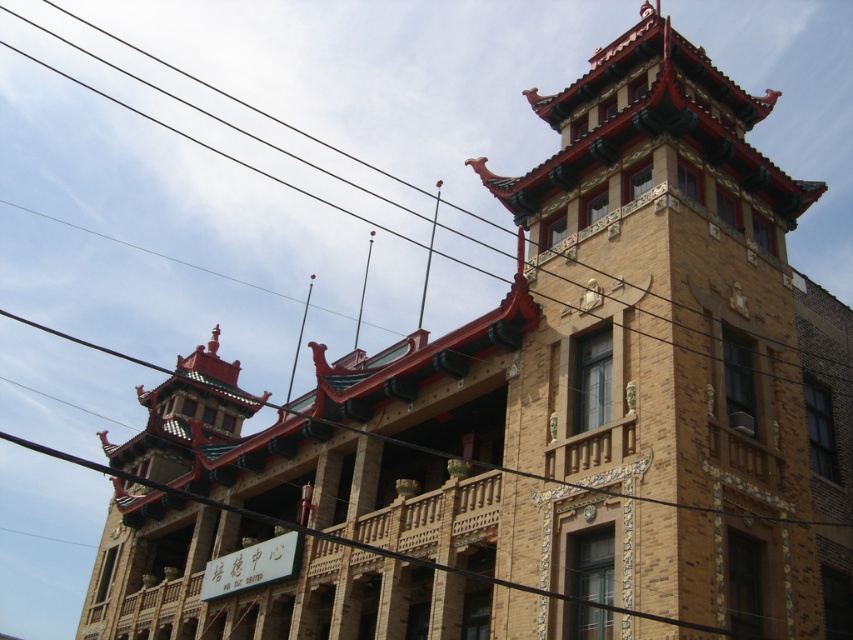
You are an architect analyzing the building. You observe the yellow brick tower at upper center and the black wire at upper center. Which of these two objects has a smaller width?

The yellow brick tower at upper center has a smaller width than the black wire at upper center.

You are standing at the entrance of the building and want to walk towards the point at coordinates point (x=698, y=305) and point (x=283, y=180). Which point will you reach first?

You will reach point (x=698, y=305) first because it is in front of point (x=283, y=180) from your current position.

You are an architect analyzing the building depicted in the image. You notice the yellow brick tower at upper center and the black wire at upper center. Which of these two elements is positioned higher in the structure?

The black wire at upper center is positioned higher in the structure because the yellow brick tower at upper center is shorter than it.